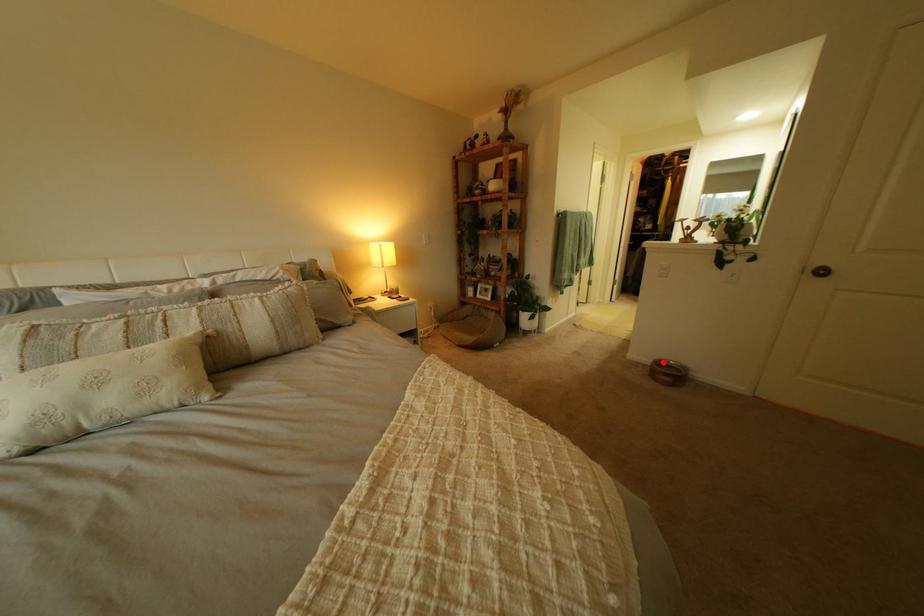
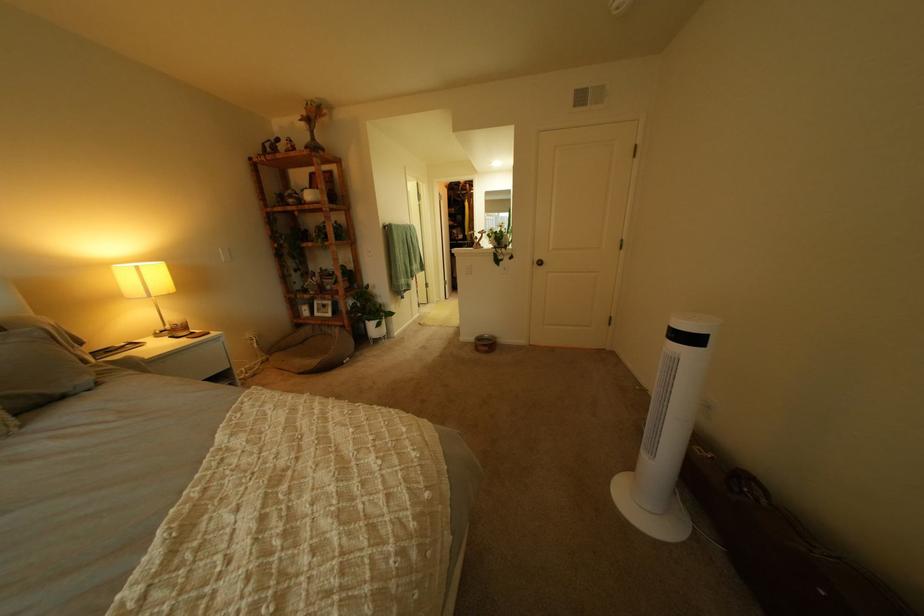
Where in the second image is the point corresponding to the highlighted location from the first image?

(489, 339)